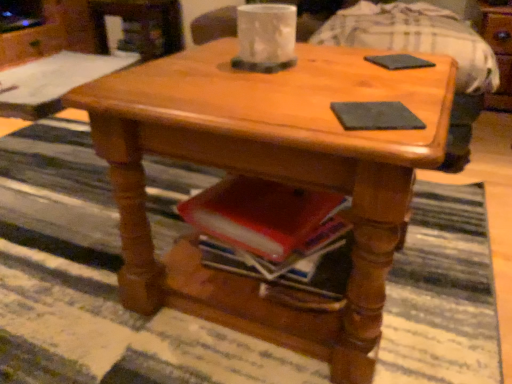
Find the location of a particular element. This screenshot has height=384, width=512. vacant space that's between black matte pad at upper right, acting as the 1th pad starting from the back, and black matte pad at center, acting as the 2th pad starting from the back is located at coordinates (394, 84).